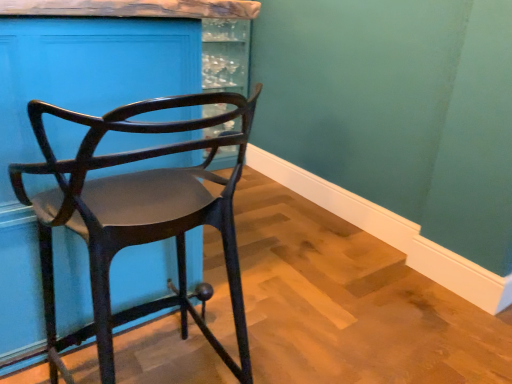
Locate an element on the screen. free location to the right of matte black chair at left is located at coordinates (295, 297).